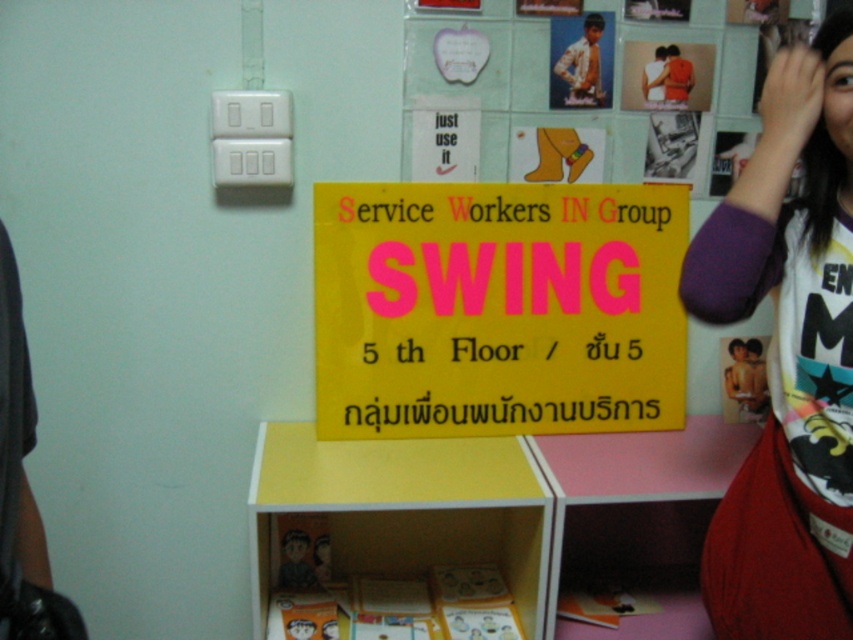
Question: Does yellow matte sign at center appear on the right side of white printed t-shirt at upper right?

Choices:
 (A) no
 (B) yes

Answer: (A)

Question: Is yellow matte sign at center wider than white printed t-shirt at upper right?

Choices:
 (A) no
 (B) yes

Answer: (B)

Question: Among these points, which one is farthest from the camera?

Choices:
 (A) (387, 275)
 (B) (732, 544)

Answer: (A)

Question: Can you confirm if yellow matte sign at center is positioned below white printed t-shirt at upper right?

Choices:
 (A) yes
 (B) no

Answer: (B)

Question: Which object is farther from the camera taking this photo?

Choices:
 (A) white printed t-shirt at upper right
 (B) yellow matte sign at center

Answer: (B)

Question: Which object is closer to the camera taking this photo?

Choices:
 (A) yellow matte sign at center
 (B) white printed t-shirt at upper right

Answer: (B)